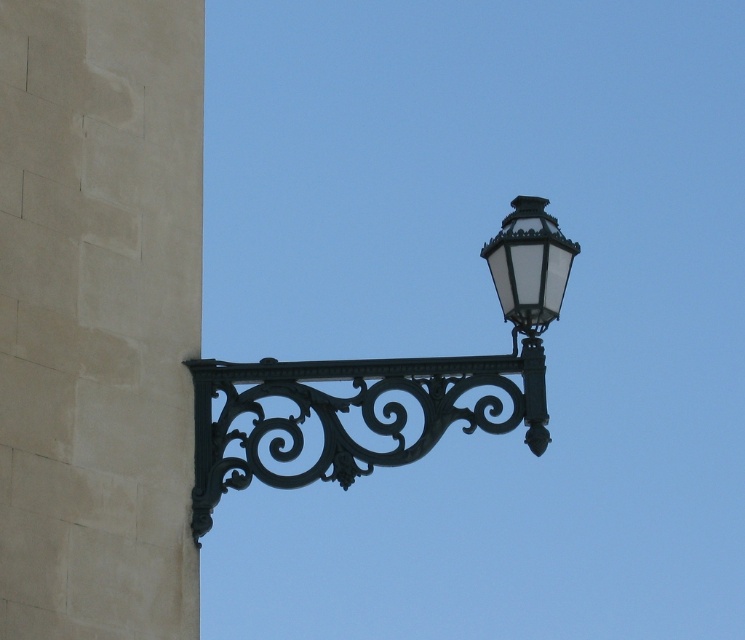
Question: Which object appears farthest from the camera in this image?

Choices:
 (A) matte black street light at upper right
 (B) black wrought iron streetlight at upper right

Answer: (A)

Question: Which object is farther from the camera taking this photo?

Choices:
 (A) black wrought iron streetlight at upper right
 (B) matte black street light at upper right

Answer: (B)

Question: Can you confirm if black wrought iron streetlight at upper right is positioned below matte black street light at upper right?

Choices:
 (A) yes
 (B) no

Answer: (A)

Question: Can you confirm if black wrought iron streetlight at upper right is wider than matte black street light at upper right?

Choices:
 (A) no
 (B) yes

Answer: (B)

Question: Is black wrought iron streetlight at upper right below matte black street light at upper right?

Choices:
 (A) no
 (B) yes

Answer: (B)